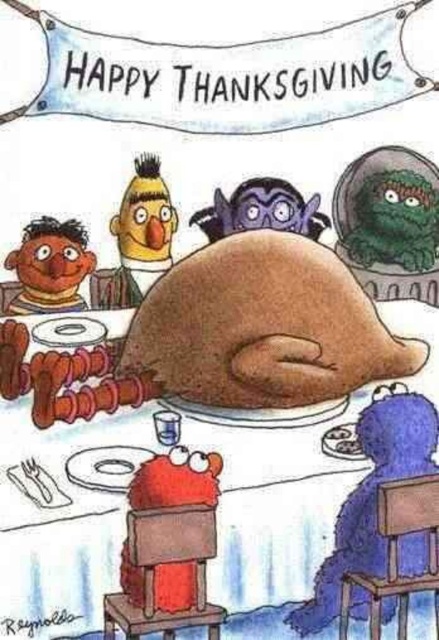
You are a guest at the Thanksgiving table and want to know which object is taller between the brown matte turkey at center and the green fuzzy monster at upper right. Based on the scene, can you determine which one is taller?

The brown matte turkey at center is taller than the green fuzzy monster at upper right.

You are standing in front of the Thanksgiving table and want to place a new decoration. You have two points marked on the table where you can place it. The first point is at coordinate point(403, 173) and the second is at point(71, 260). Which point is closer to you?

Point(403, 173) is further to the camera than point(71, 260), so the second point is closer to you.